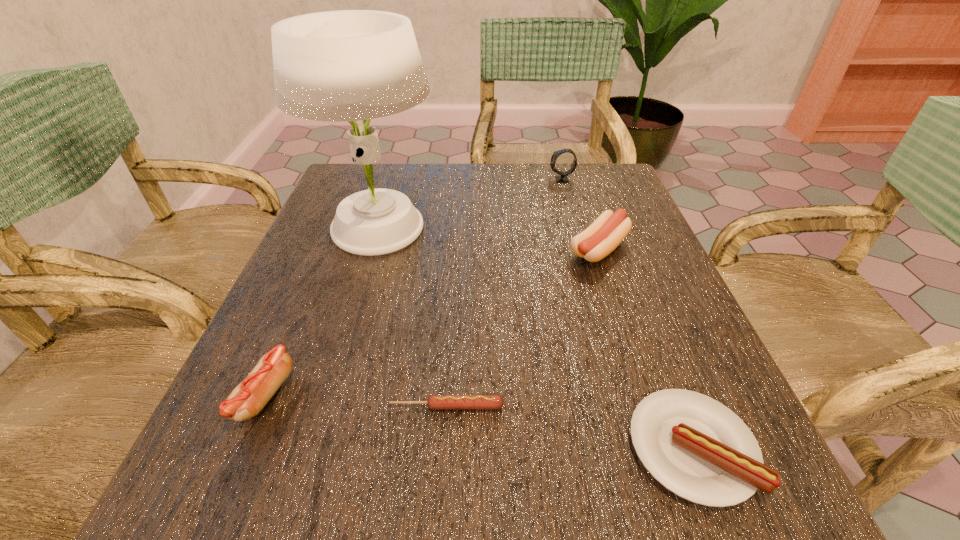
In order to click on empty space that is in between the third tallest sausage and the shortest sausage in this screenshot , I will do `click(569, 427)`.

Image resolution: width=960 pixels, height=540 pixels. In order to click on object that is the fifth closest one to the fifth shortest object in this screenshot , I will do `click(246, 400)`.

Identify which object is the fourth closest to the watch. Please provide its 2D coordinates. Your answer should be formatted as a tuple, i.e. [(x, y)], where the tuple contains the x and y coordinates of a point satisfying the conditions above.

[(435, 402)]

You are a GUI agent. You are given a task and a screenshot of the screen. Output one action in this format:
    pyautogui.click(x=<x>, y=<y>)
    Task: Click on the sausage that is the nearest to the leftmost sausage
    The image size is (960, 540).
    Given the screenshot: What is the action you would take?
    pyautogui.click(x=435, y=402)

Identify which sausage is the second closest to the lamp. Please provide its 2D coordinates. Your answer should be formatted as a tuple, i.e. [(x, y)], where the tuple contains the x and y coordinates of a point satisfying the conditions above.

[(603, 236)]

Where is `blank space that satisfies the following two spatial constraints: 1. on the front-facing side of the lamp; 2. on the back side of the third sausage from right to left`? blank space that satisfies the following two spatial constraints: 1. on the front-facing side of the lamp; 2. on the back side of the third sausage from right to left is located at coordinates pos(326,406).

Identify the location of free spot that satisfies the following two spatial constraints: 1. on the front side of the second sausage from left to right; 2. on the right side of the leftmost sausage. The image size is (960, 540). (260, 406).

Locate an element on the screen. This screenshot has height=540, width=960. vacant area that satisfies the following two spatial constraints: 1. on the front-facing side of the lamp; 2. on the left side of the third tallest sausage is located at coordinates (314, 448).

Locate an element on the screen. free space that satisfies the following two spatial constraints: 1. on the front-facing side of the lamp; 2. on the left side of the farthest sausage is located at coordinates (373, 249).

Identify the location of free space that satisfies the following two spatial constraints: 1. on the front-facing side of the tallest object; 2. on the right side of the farthest sausage. The image size is (960, 540). (373, 249).